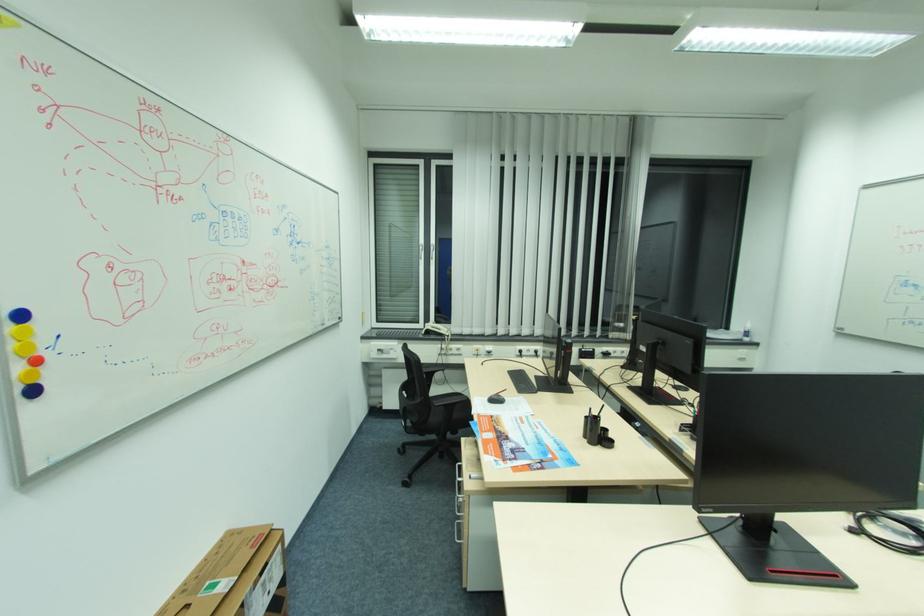
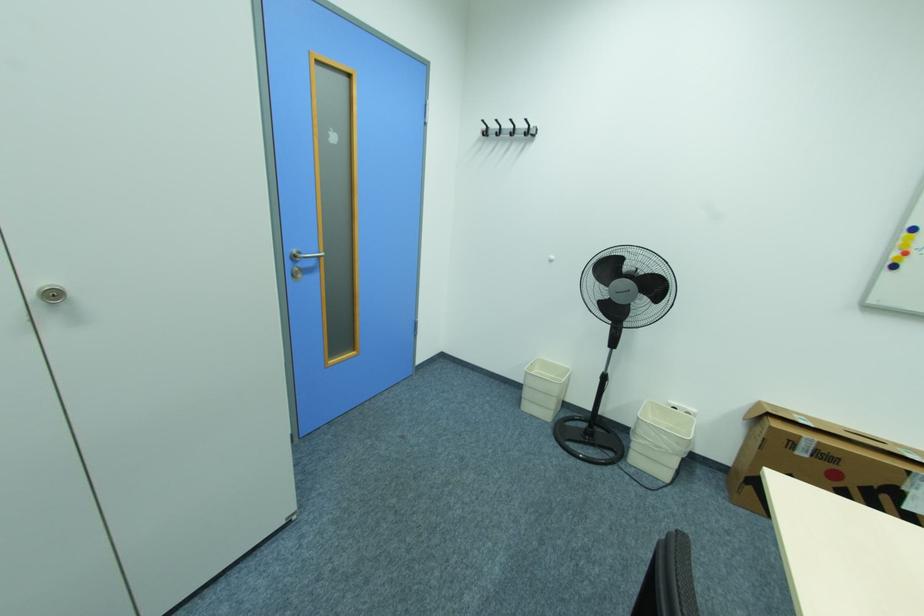
Find the pixel in the second image that matches [42,362] in the first image.

(910, 253)